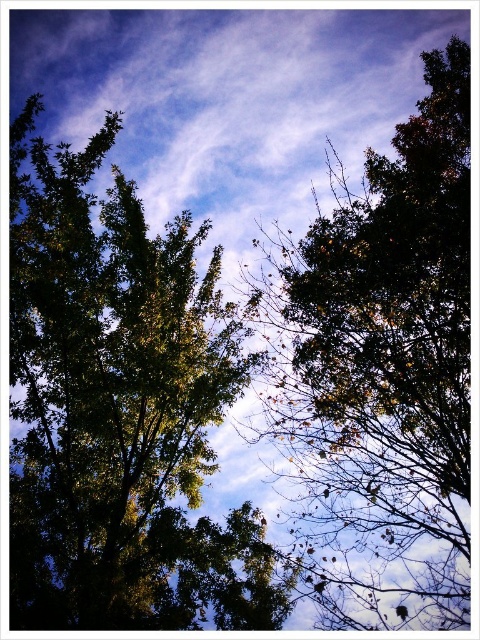
Does green leafy tree at center appear over dark green leafy tree at upper center?

No.

Does green leafy tree at center have a smaller size compared to dark green leafy tree at upper center?

Indeed, green leafy tree at center has a smaller size compared to dark green leafy tree at upper center.

This screenshot has height=640, width=480. I want to click on green leafy tree at center, so click(120, 410).